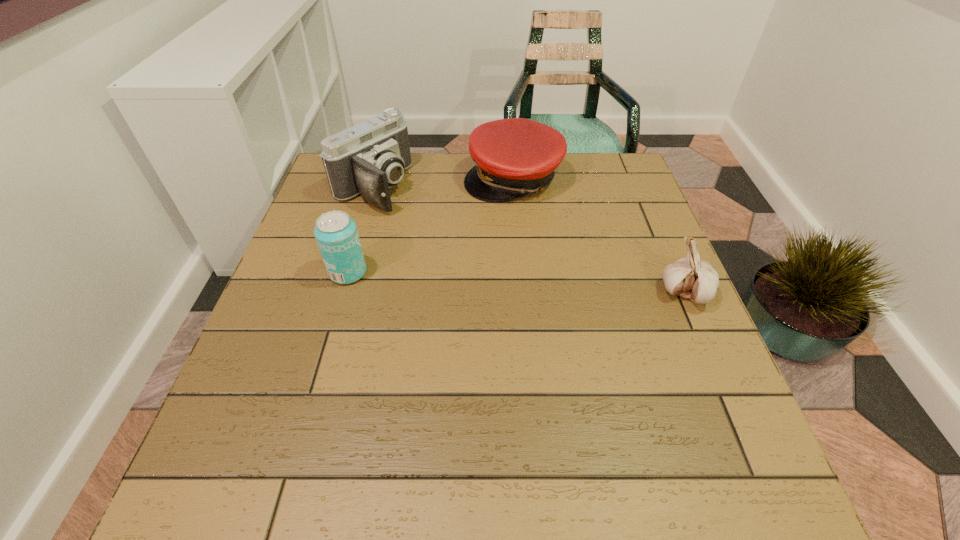
The image size is (960, 540). I want to click on free region that satisfies the following two spatial constraints: 1. on the front side of the cap; 2. on the left side of the garlic, so click(523, 293).